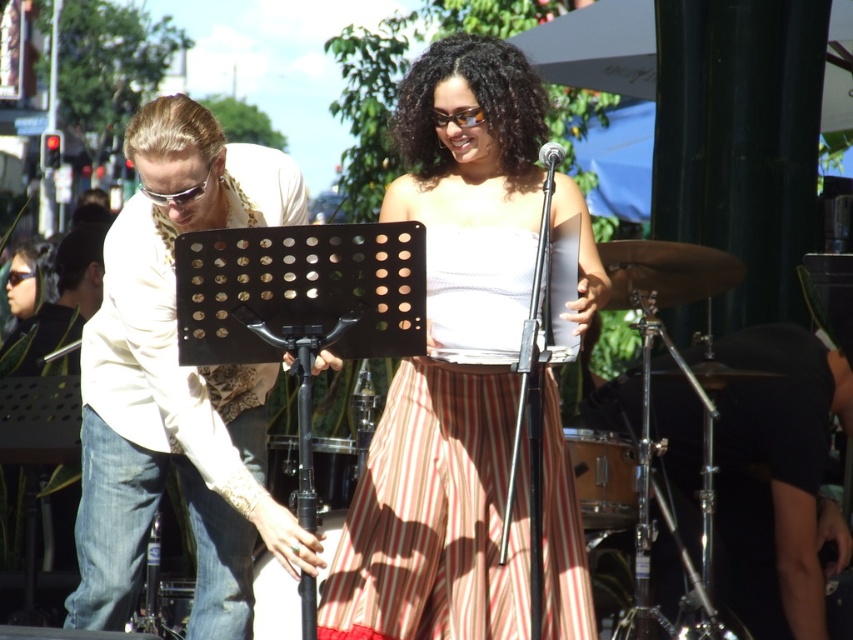
This screenshot has height=640, width=853. Find the location of `white lace shirt at left`. white lace shirt at left is located at coordinates point(178,385).

Is white lace shirt at left to the right of wooden drum at center from the viewer's perspective?

Incorrect, white lace shirt at left is not on the right side of wooden drum at center.

Between point (279, 182) and point (602, 460), which one is positioned behind?

Point (602, 460)

The image size is (853, 640). I want to click on white lace shirt at left, so click(178, 385).

Is white satin dress at center taller than wooden drum at center?

Yes, white satin dress at center is taller than wooden drum at center.

Locate an element on the screen. The image size is (853, 640). white satin dress at center is located at coordinates (432, 516).

Does white satin dress at center appear under white lace shirt at left?

Indeed, white satin dress at center is positioned under white lace shirt at left.

Locate an element on the screen. white satin dress at center is located at coordinates (432, 516).

Locate an element on the screen. The image size is (853, 640). white satin dress at center is located at coordinates (432, 516).